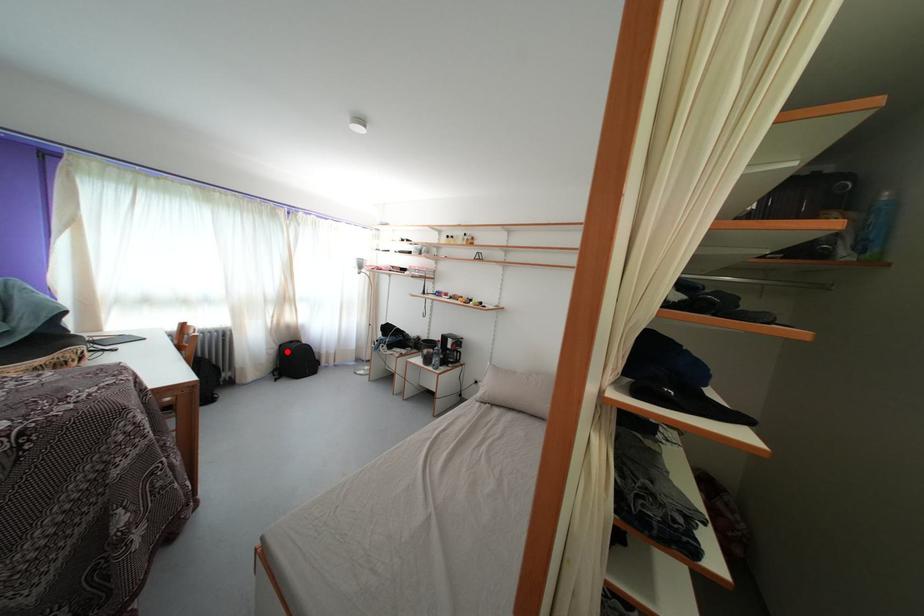
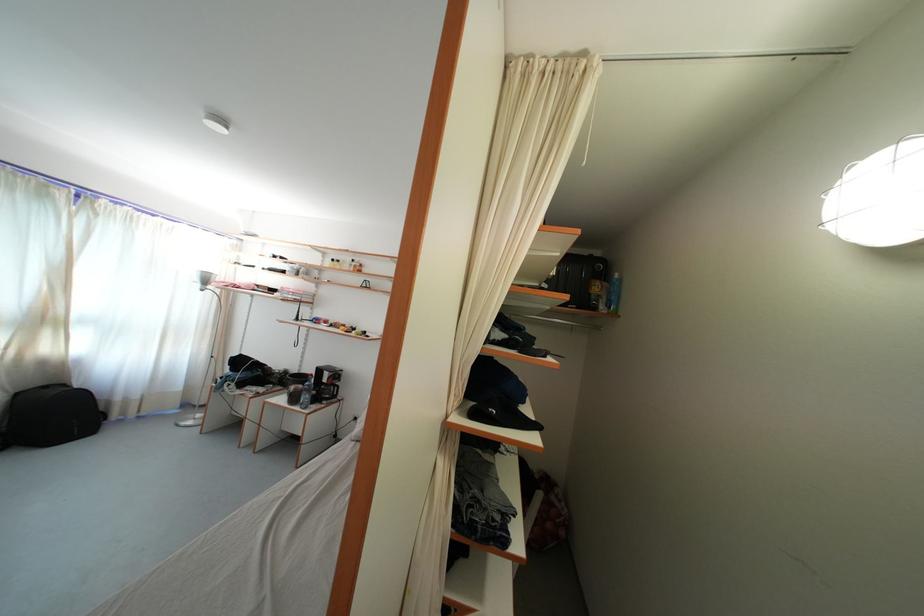
Locate, in the second image, the point that corresponds to the highlighted location in the first image.

(23, 400)